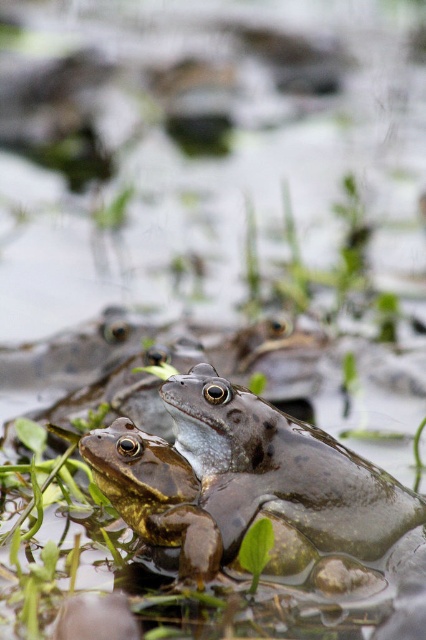
Is smooth green frog at center wider than green matte frog at center?

Yes.

Is smooth green frog at center positioned in front of green matte frog at center?

No, it is behind green matte frog at center.

Describe the element at coordinates (284, 477) in the screenshot. This screenshot has height=640, width=426. I see `smooth green frog at center` at that location.

Identify the location of smooth green frog at center. The width and height of the screenshot is (426, 640). (284, 477).